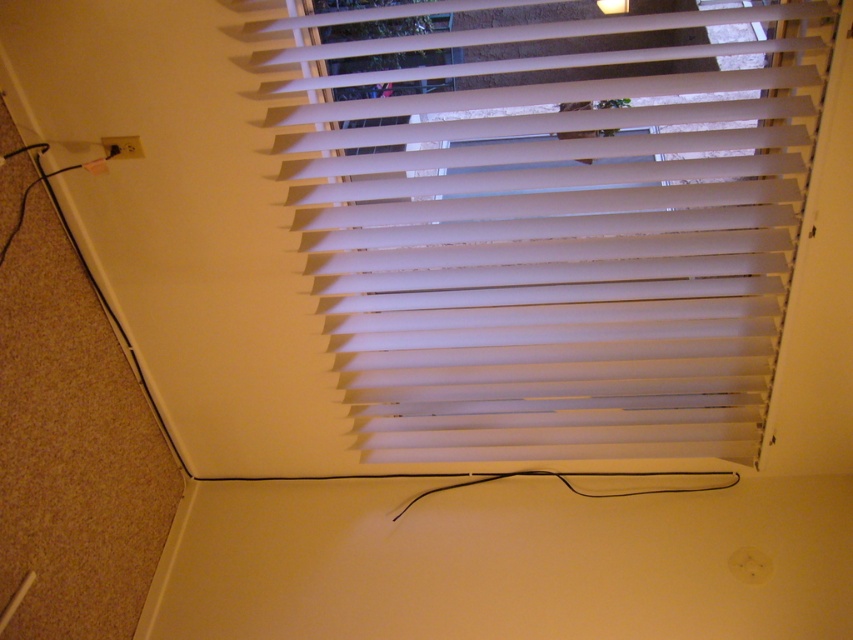
You are an interior designer assessing the room layout. You need to determine which object occupies more space in the upper center area of the room between the white matte blinds at upper center and the white plastic lampshade at upper center. Which one is larger?

The white matte blinds at upper center has a larger size compared to the white plastic lampshade at upper center, so the white matte blinds at upper center occupies more space in the upper center area.

You are standing in the room and want to see the white plastic lampshade at upper center. Is it possible to see it without moving the white matte blinds at upper center?

The white matte blinds at upper center is in front of white plastic lampshade at upper center, so you cannot see the white plastic lampshade at upper center without moving the white matte blinds at upper center.